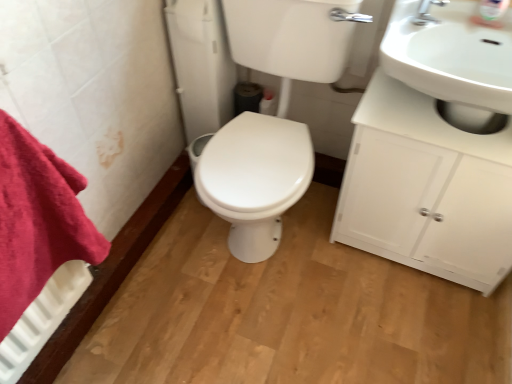
Question: From the image's perspective, is white glossy toilet at center above or below white glossy sink at upper right?

Choices:
 (A) below
 (B) above

Answer: (A)

Question: From a real-world perspective, relative to white glossy sink at upper right, is white glossy toilet at center vertically above or below?

Choices:
 (A) below
 (B) above

Answer: (A)

Question: Estimate the real-world distances between objects in this image. Which object is farther from the silver metallic faucet at upper right?

Choices:
 (A) red cotton towel at left
 (B) white glossy cabinet at right
 (C) white glossy sink at upper right
 (D) white glossy toilet at center

Answer: (A)

Question: Which of these objects is positioned farthest from the white glossy toilet at center?

Choices:
 (A) white glossy cabinet at right
 (B) white glossy sink at upper right
 (C) red cotton towel at left
 (D) silver metallic faucet at upper right

Answer: (C)